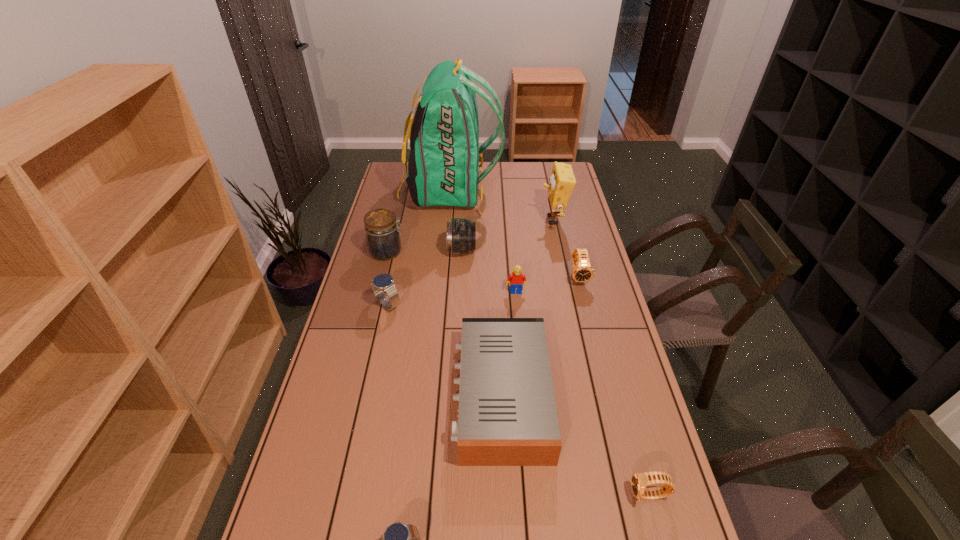
Identify the location of watch that is at the left edge. The width and height of the screenshot is (960, 540). (384, 282).

Where is `sponge that is at the right edge`? sponge that is at the right edge is located at coordinates (562, 181).

I want to click on object located in the far left corner section of the desktop, so click(443, 167).

In order to click on vacant space at the far edge of the desktop in this screenshot , I will do `click(533, 185)`.

The height and width of the screenshot is (540, 960). What are the coordinates of `blank space at the left edge` in the screenshot? It's located at (332, 421).

In the image, there is a desktop. Identify the location of vacant space at the right edge. The width and height of the screenshot is (960, 540). (618, 511).

In the image, there is a desktop. Where is `vacant space at the far right corner`? The image size is (960, 540). vacant space at the far right corner is located at coordinates (549, 172).

I want to click on vacant area that lies between the telephoto lens and the second tallest object, so click(508, 235).

Locate an element on the screen. The width and height of the screenshot is (960, 540). free space that is in between the red Lego and the jar is located at coordinates (452, 272).

At what (x,y) coordinates should I click in order to perform the action: click on free point between the sponge and the red Lego. Please return your answer as a coordinate pair (x, y). The height and width of the screenshot is (540, 960). Looking at the image, I should click on (535, 256).